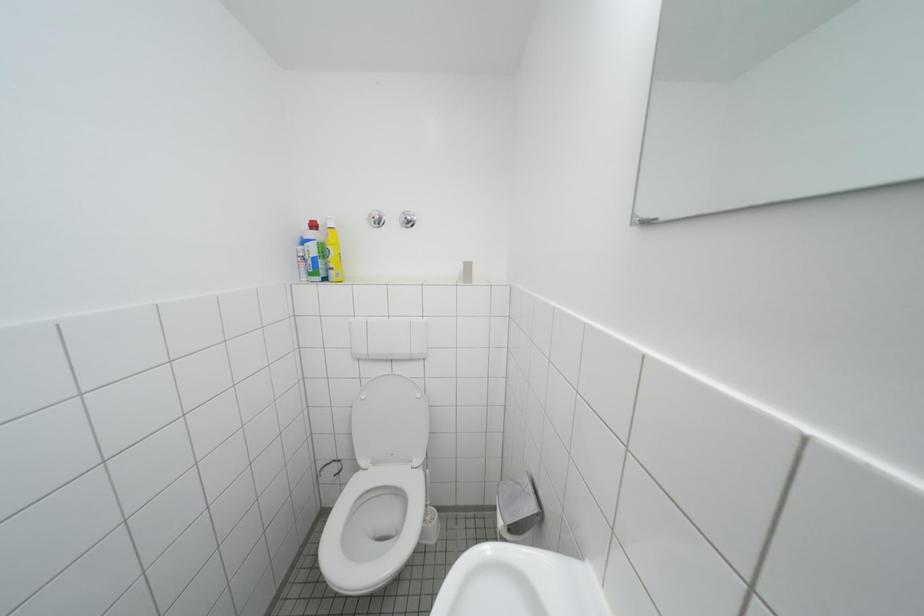
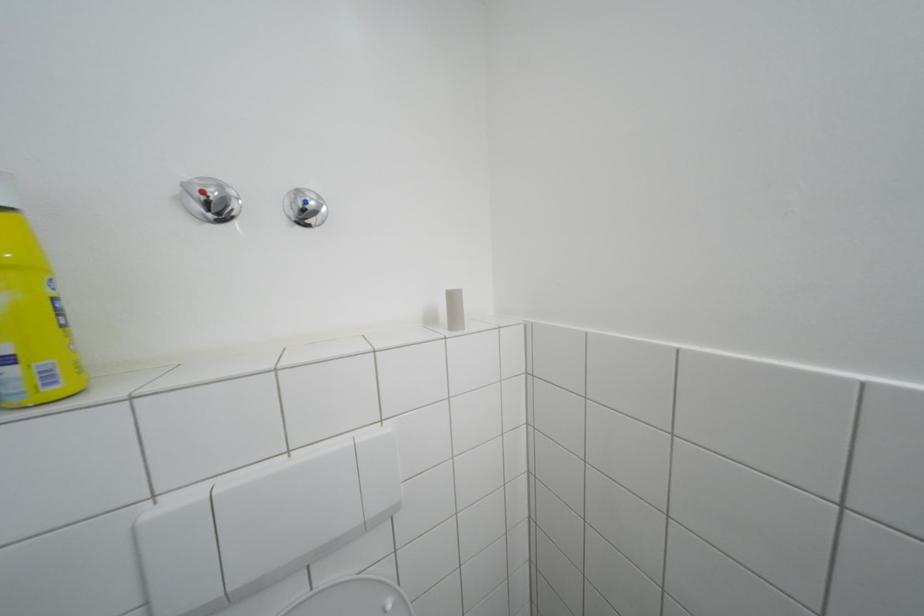
Question: Based on the continuous images, in which direction is the camera rotating? Reply with the corresponding letter.

Choices:
 (A) Left
 (B) Right
 (C) Up
 (D) Down

Answer: (B)